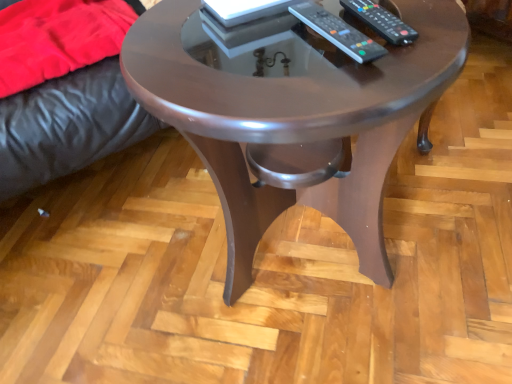
Where is `space that is in front of black plastic remote at upper right, marked as the 1th remote in a right-to-left arrangement`? The image size is (512, 384). space that is in front of black plastic remote at upper right, marked as the 1th remote in a right-to-left arrangement is located at coordinates (387, 65).